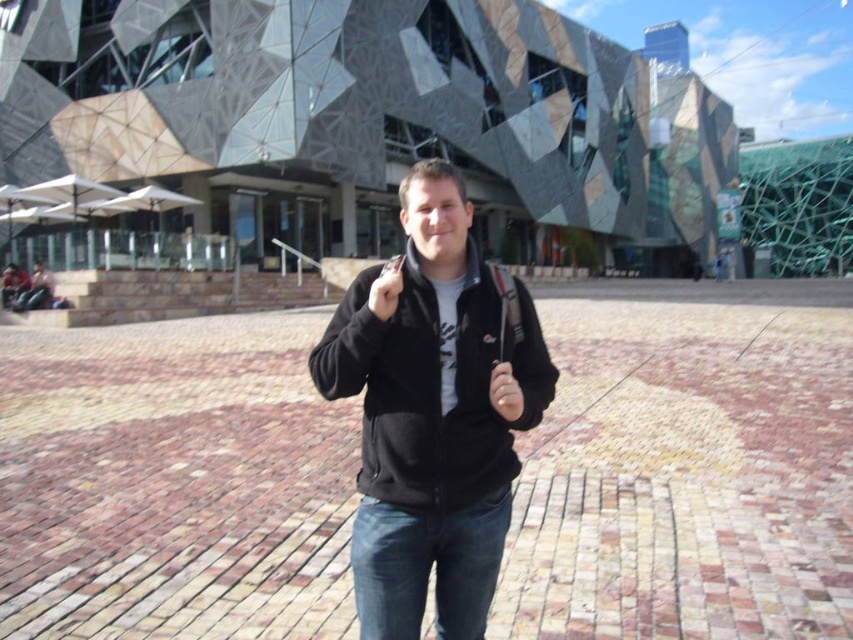
You are a photographer trying to capture the modern building in the background while ensuring both the denim at center and the matte black phone at center are visible in the frame. Which object should you adjust your focus on to ensure both are in the shot without moving the camera?

The denim at center is narrower than the matte black phone at center, so you should focus on the wider matte black phone at center to ensure both fit within the frame.

You are standing in front of the modern architectural structure and want to take a photo. There are two points marked on the ground at coordinates point (795,472) and point (492,385). Which point is closer to your camera position?

Point (492,385) is closer to the camera position because the description states that point (795,472) is further to the camera than point (492,385).

You are a photographer trying to capture the person in the scene. You notice the denim at center and the matte black phone at center. Which object should you adjust to ensure the person is fully visible in the photo?

The denim at center is positioned under the matte black phone at center. To ensure the person is fully visible, you should adjust the matte black phone at center to move it out of the way since it is covering the denim at center, which is part of the person.